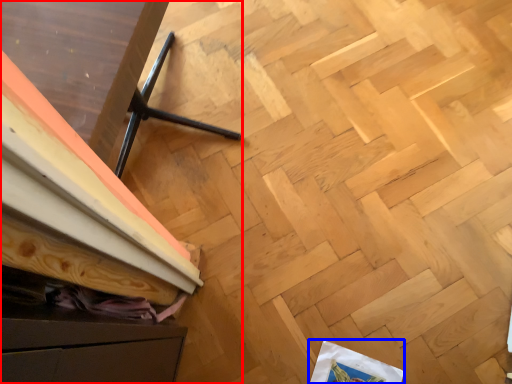
Question: Which object is closer to the camera taking this photo, furniture (highlighted by a red box) or wrapping paper (highlighted by a blue box)?

Choices:
 (A) furniture
 (B) wrapping paper

Answer: (A)